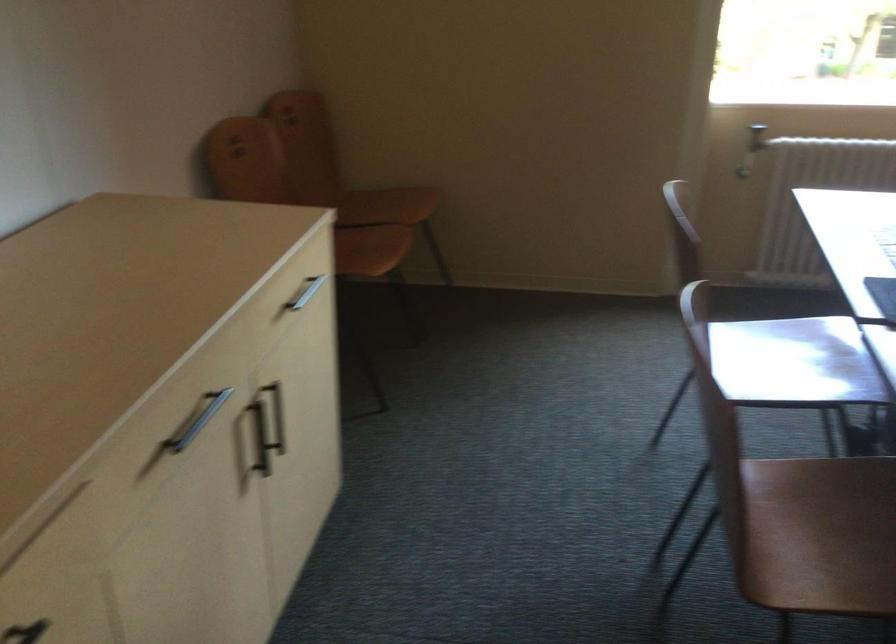
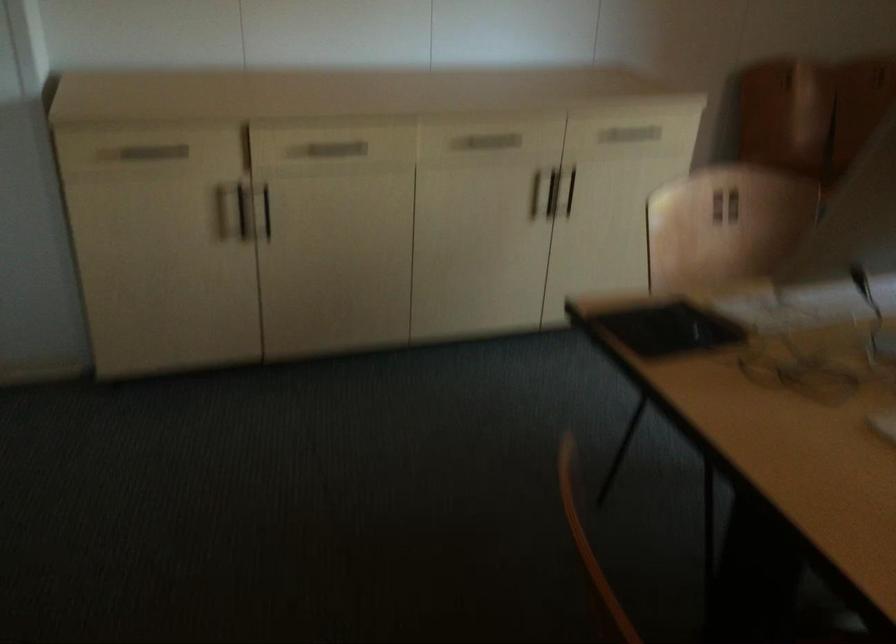
Where in the second image is the point corresponding to the point at 255,418 from the first image?

(570, 192)